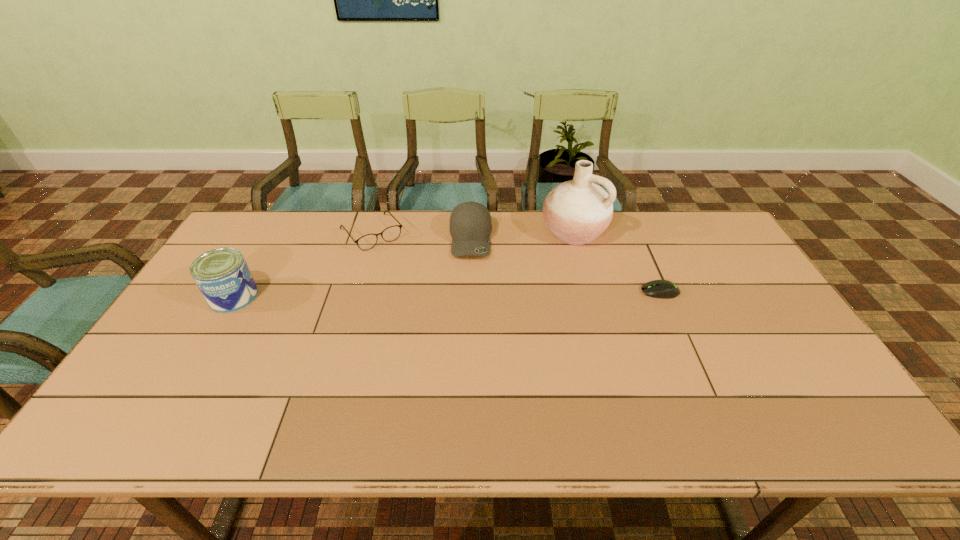
Find the location of a particular element. vacant spot on the desktop that is between the can and the computer mouse and is positioned on the front brim of the baseball cap is located at coordinates (474, 294).

Locate an element on the screen. The width and height of the screenshot is (960, 540). free space on the desktop that is between the leftmost object and the shortest object and is positioned on the front-facing side of the second shortest object is located at coordinates (420, 295).

Locate an element on the screen. The image size is (960, 540). free spot on the desktop that is between the leftmost object and the rightmost object and is positioned to pour from the handle of the tallest object is located at coordinates (506, 294).